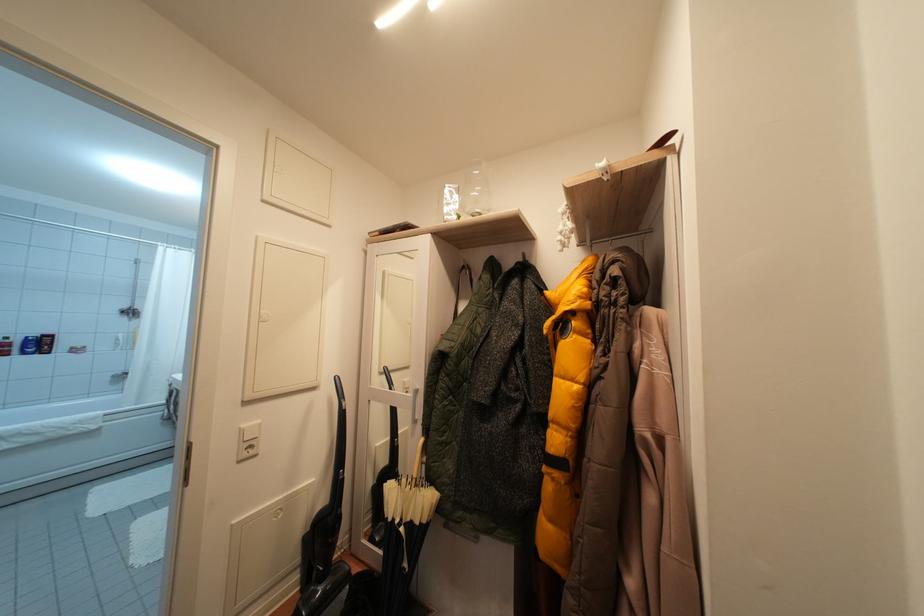
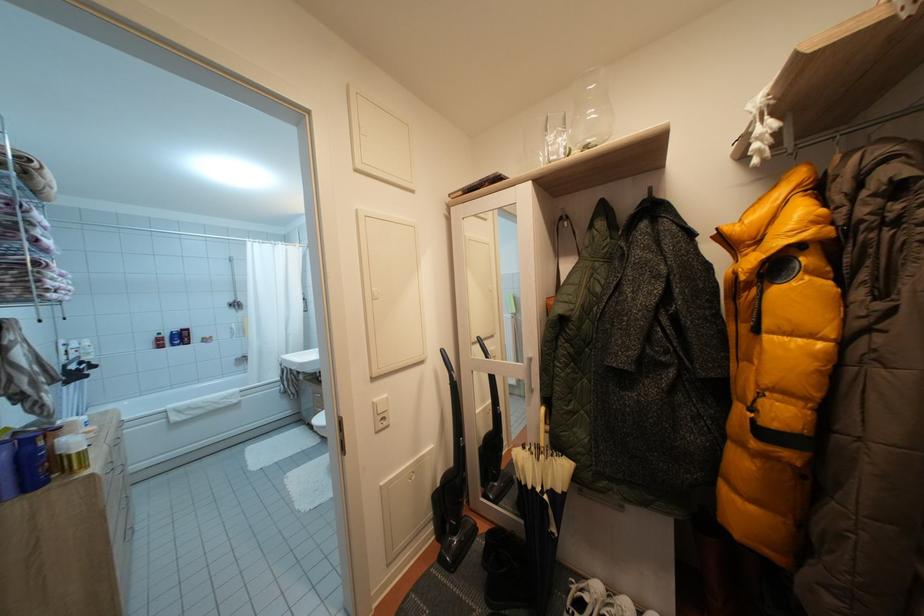
Question: The first image is from the beginning of the video and the second image is from the end. How did the camera likely rotate when shooting the video?

Choices:
 (A) Left
 (B) Right
 (C) Up
 (D) Down

Answer: (A)